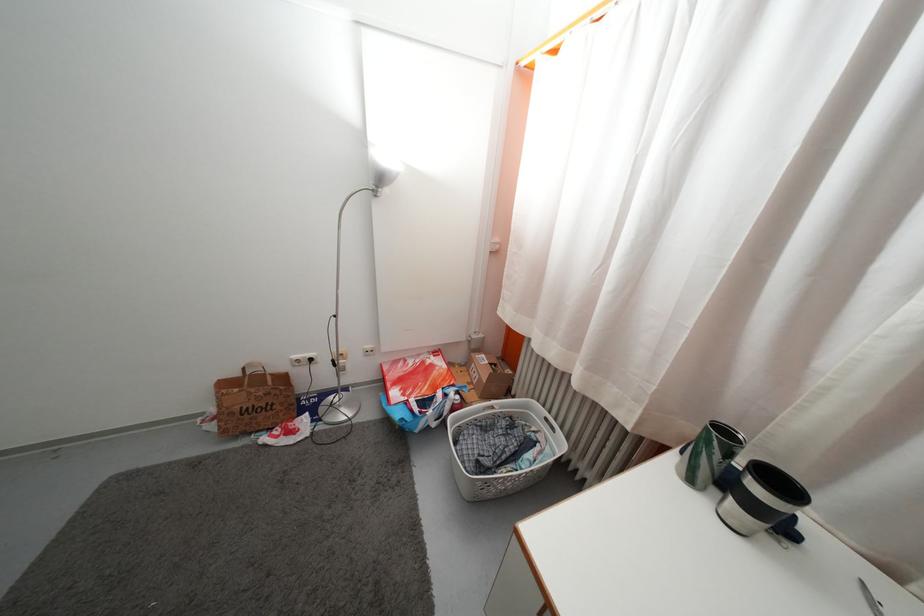
What do you see at coordinates (383, 179) in the screenshot? This screenshot has width=924, height=616. I see `the silver lamp head` at bounding box center [383, 179].